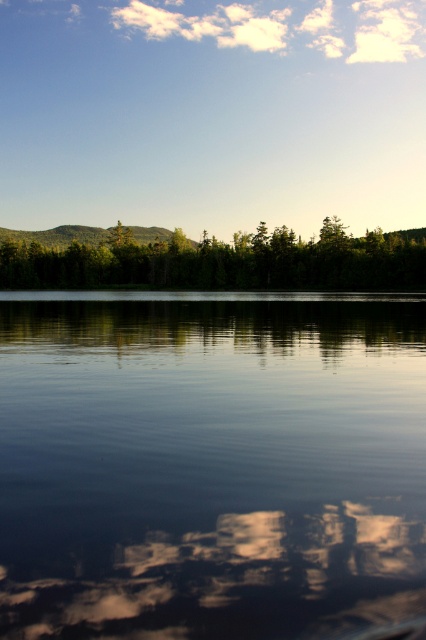
Is point (163, 324) behind point (91, 280)?

No, it is in front of (91, 280).

Which is in front, point (196, 595) or point (13, 273)?

Positioned in front is point (196, 595).

Identify the location of transparent water at center. (210, 465).